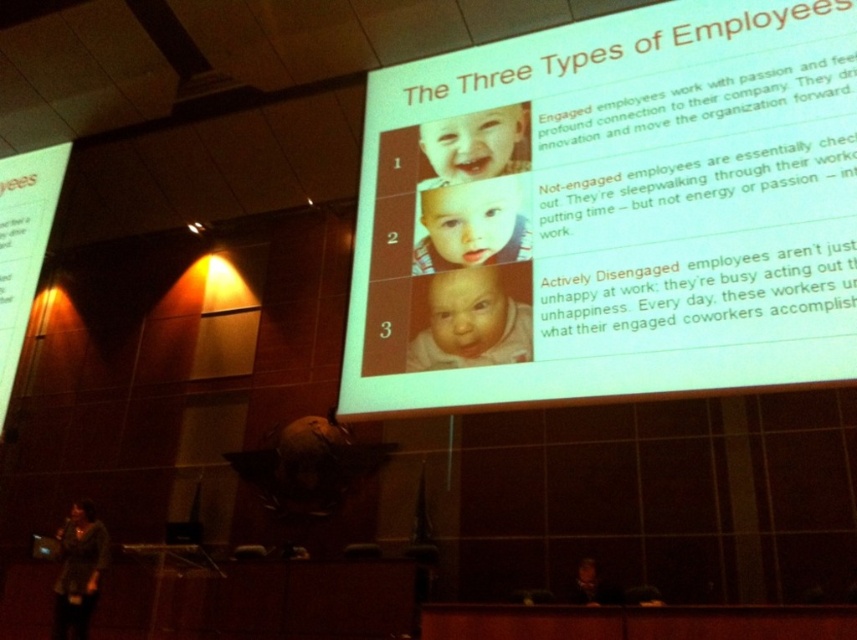
Question: Which object is the farthest from the smooth plastic baby at center?

Choices:
 (A) smooth white baby at center
 (B) white paper at upper center

Answer: (B)

Question: Considering the real-world distances, which object is farthest from the smooth plastic baby at center?

Choices:
 (A) smooth white baby at center
 (B) white paper at upper center

Answer: (B)

Question: Can you confirm if smooth white baby at center is smaller than smooth plastic baby at center?

Choices:
 (A) yes
 (B) no

Answer: (A)

Question: Is white paper at upper center above smooth plastic baby at center?

Choices:
 (A) yes
 (B) no

Answer: (A)

Question: Which point appears closest to the camera in this image?

Choices:
 (A) (446, 99)
 (B) (488, 310)
 (C) (476, 262)

Answer: (B)

Question: In this image, where is white paper at upper center located relative to smooth plastic baby at center?

Choices:
 (A) below
 (B) above

Answer: (B)